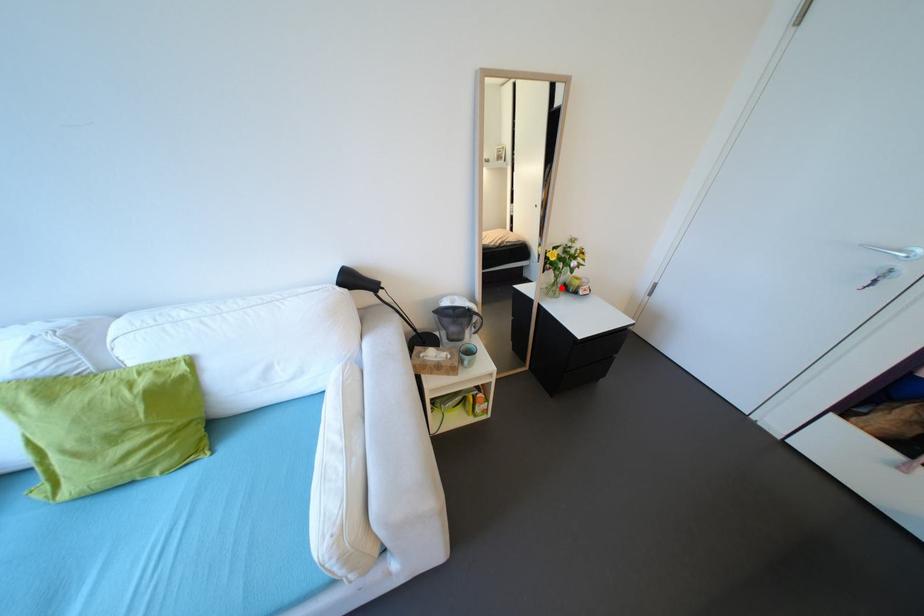
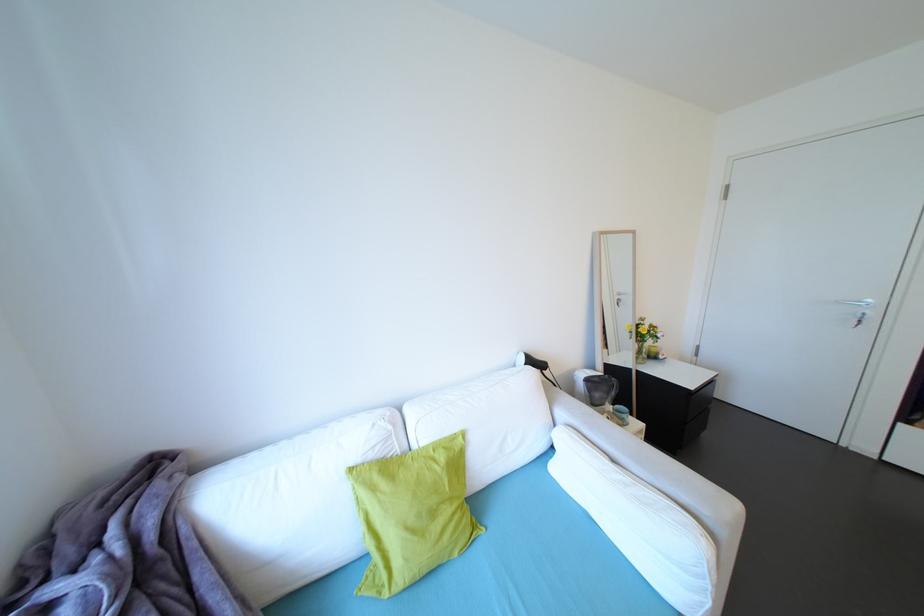
Question: I am providing you with two images of the same scene from different viewpoints. In image1, a red point is highlighted. Considering the same 3D point in image2, which of the following is correct?

Choices:
 (A) It is closer
 (B) It is farther

Answer: (A)